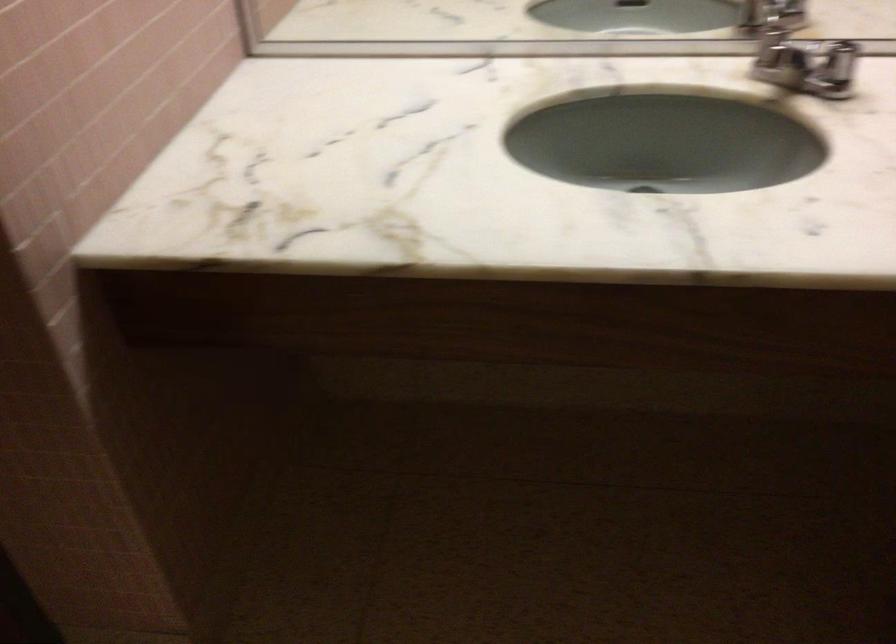
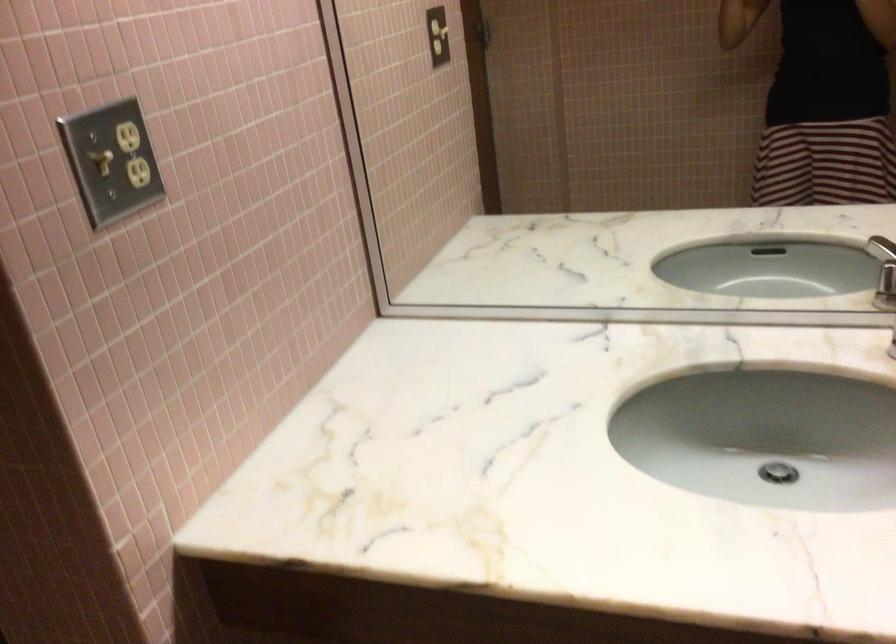
Question: Based on the continuous images, in which direction is the camera rotating? Reply with the corresponding letter.

Choices:
 (A) Left
 (B) Right
 (C) Up
 (D) Down

Answer: (C)